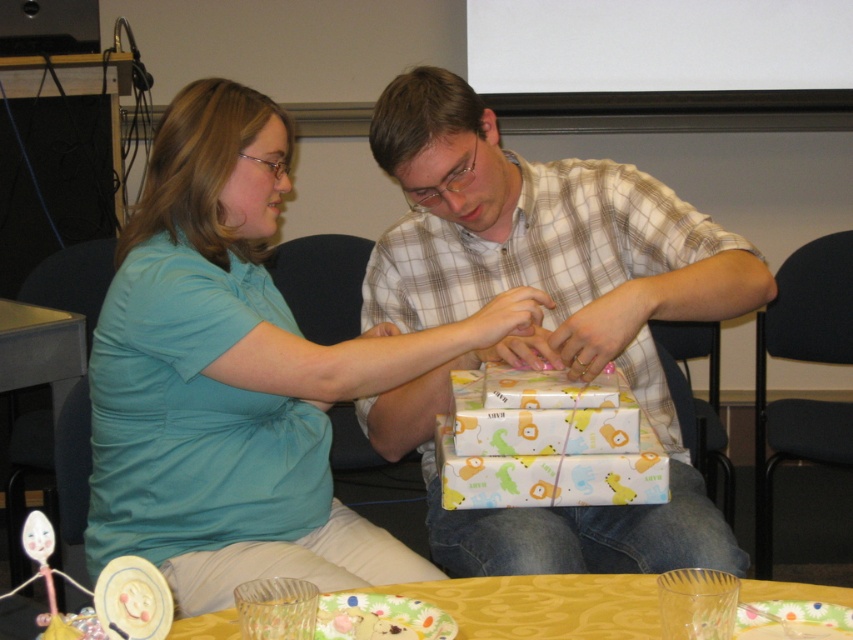
Where is the plaid shirt at center located in the image?

The plaid shirt at center is located at point [544,316].

You are a photographer standing in front of the table and want to take a photo of both the matte teal shirt at center and the plaid shirt at center. Which one should you focus on first to ensure both are in clear view?

You should focus on the matte teal shirt at center first because it is closer to the viewer than the plaid shirt at center, so adjusting focus from near to far will help both appear clear.